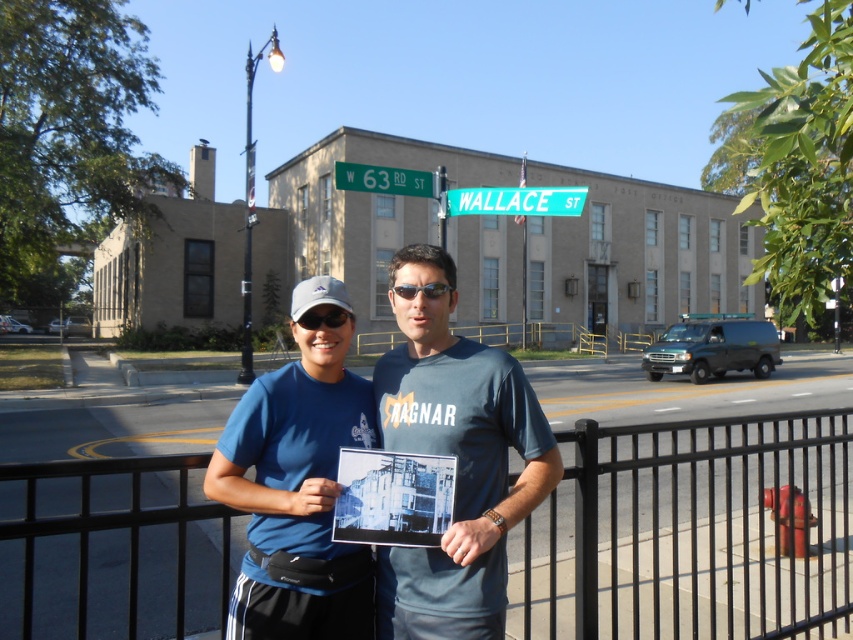
In the scene shown: You are a photographer trying to capture a wide shot of the scene. The black metal fence at lower center and the green metallic street sign at upper center are both in view. Which object should you focus on first if you want to ensure both are in focus?

The black metal fence at lower center is larger in size than the green metallic street sign at upper center, so focusing on the larger object first will help ensure both are in focus.

You are a photographer trying to capture a clear shot of the black plastic goggles at center and the sunglasses at center. Since both items are at the center, which one will appear larger in the photo?

The black plastic goggles at center has a greater height compared to sunglasses at center, so it will appear larger in the photo.